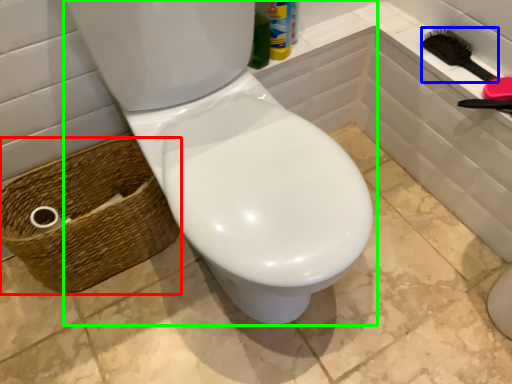
Question: Considering the real-world distances, which object is farthest from basket (highlighted by a red box)? brush (highlighted by a blue box) or toilet (highlighted by a green box)?

Choices:
 (A) brush
 (B) toilet

Answer: (A)